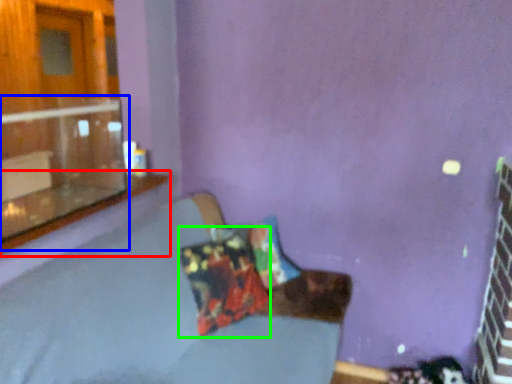
Question: Which object is positioned farthest from window sill (highlighted by a red box)? Select from window (highlighted by a blue box) and pillow (highlighted by a green box).

Choices:
 (A) window
 (B) pillow

Answer: (B)